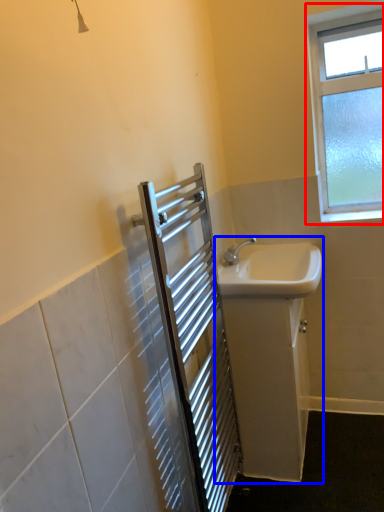
Question: Which of the following is the closest to the observer, window (highlighted by a red box) or sink (highlighted by a blue box)?

Choices:
 (A) window
 (B) sink

Answer: (B)